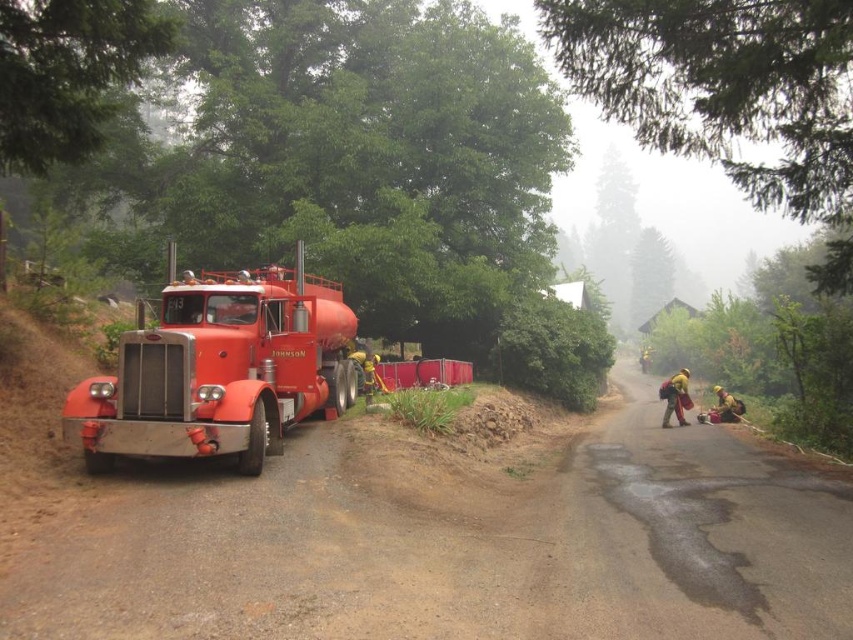
Does dirt track at left appear on the left side of yellow fabric backpack at lower right?

Indeed, dirt track at left is positioned on the left side of yellow fabric backpack at lower right.

This screenshot has height=640, width=853. What do you see at coordinates (438, 536) in the screenshot? I see `dirt track at left` at bounding box center [438, 536].

Find the location of a particular element. This screenshot has height=640, width=853. dirt track at left is located at coordinates (438, 536).

Can you confirm if yellow fabric backpack at lower right is thinner than yellow fireproof suit at lower right?

Indeed, yellow fabric backpack at lower right has a lesser width compared to yellow fireproof suit at lower right.

Is yellow fabric backpack at lower right below yellow fireproof suit at lower right?

No, yellow fabric backpack at lower right is not below yellow fireproof suit at lower right.

Who is more forward, (668, 385) or (722, 410)?

Point (668, 385)

Where is `yellow fabric backpack at lower right`? yellow fabric backpack at lower right is located at coordinates (675, 396).

The width and height of the screenshot is (853, 640). What are the coordinates of `dirt track at left` in the screenshot? It's located at (438, 536).

Can you confirm if dirt track at left is positioned to the right of yellow fireproof suit at lower right?

No, dirt track at left is not to the right of yellow fireproof suit at lower right.

Does point (67, 531) come in front of point (717, 417)?

Yes, point (67, 531) is in front of point (717, 417).

The height and width of the screenshot is (640, 853). I want to click on dirt track at left, so click(438, 536).